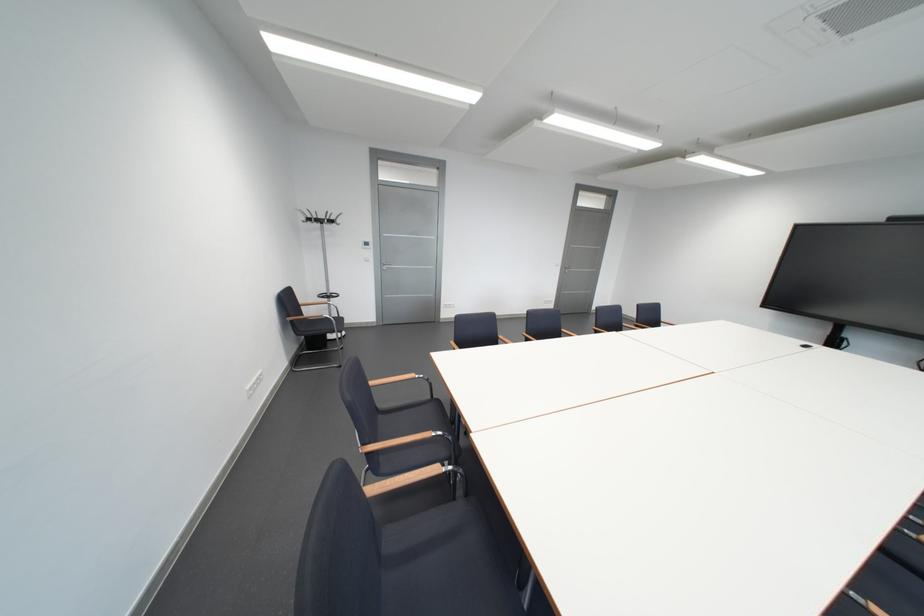
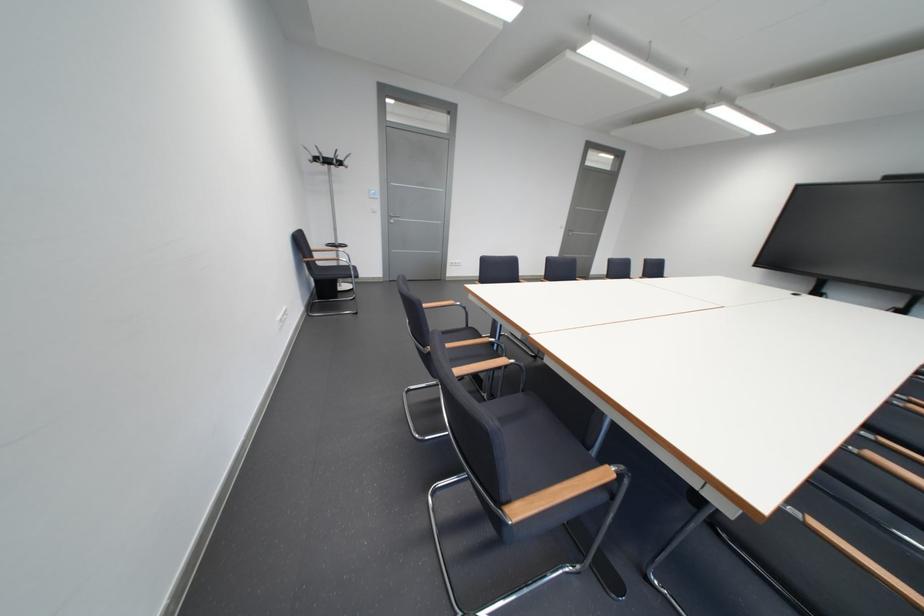
Where in the second image is the point corresponding to point 322,222 from the first image?

(330, 161)